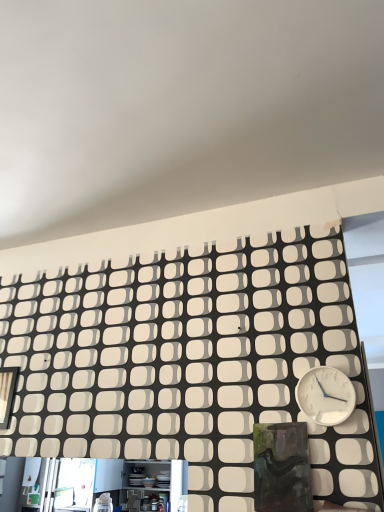
Question: From a real-world perspective, is white plastic wall clock at right positioned under matte black frame at left based on gravity?

Choices:
 (A) no
 (B) yes

Answer: (B)

Question: Can you confirm if white plastic wall clock at right is smaller than matte black frame at left?

Choices:
 (A) yes
 (B) no

Answer: (B)

Question: Can you confirm if white plastic wall clock at right is wider than matte black frame at left?

Choices:
 (A) no
 (B) yes

Answer: (B)

Question: Does white plastic wall clock at right have a lesser width compared to matte black frame at left?

Choices:
 (A) yes
 (B) no

Answer: (B)

Question: Is white plastic wall clock at right at the left side of matte black frame at left?

Choices:
 (A) yes
 (B) no

Answer: (B)

Question: Would you say matte black frame at left is part of white plastic wall clock at right's contents?

Choices:
 (A) yes
 (B) no

Answer: (B)

Question: Is matte black frame at left bigger than white plastic wall clock at right?

Choices:
 (A) no
 (B) yes

Answer: (A)

Question: Would you say matte black frame at left contains white plastic wall clock at right?

Choices:
 (A) no
 (B) yes

Answer: (A)

Question: Does matte black frame at left have a lesser width compared to white plastic wall clock at right?

Choices:
 (A) no
 (B) yes

Answer: (B)

Question: Is matte black frame at left at the left side of white plastic wall clock at right?

Choices:
 (A) yes
 (B) no

Answer: (A)

Question: Is the surface of matte black frame at left in direct contact with white plastic wall clock at right?

Choices:
 (A) no
 (B) yes

Answer: (A)

Question: From the image's perspective, would you say matte black frame at left is shown under white plastic wall clock at right?

Choices:
 (A) no
 (B) yes

Answer: (B)

Question: From the image's perspective, is white plastic wall clock at right located above or below matte black frame at left?

Choices:
 (A) below
 (B) above

Answer: (B)